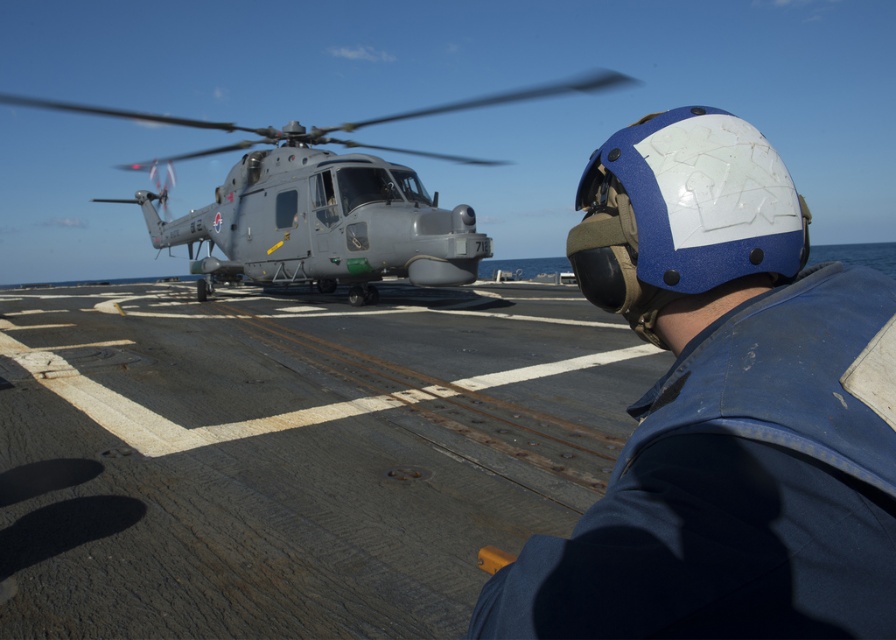
Find the location of a particular element. blue matte helmet at upper right is located at coordinates (722, 410).

Which is in front, point (685, 492) or point (269, 136)?

Point (685, 492) is in front.

Where is `blue matte helmet at upper right`? The image size is (896, 640). blue matte helmet at upper right is located at coordinates (722, 410).